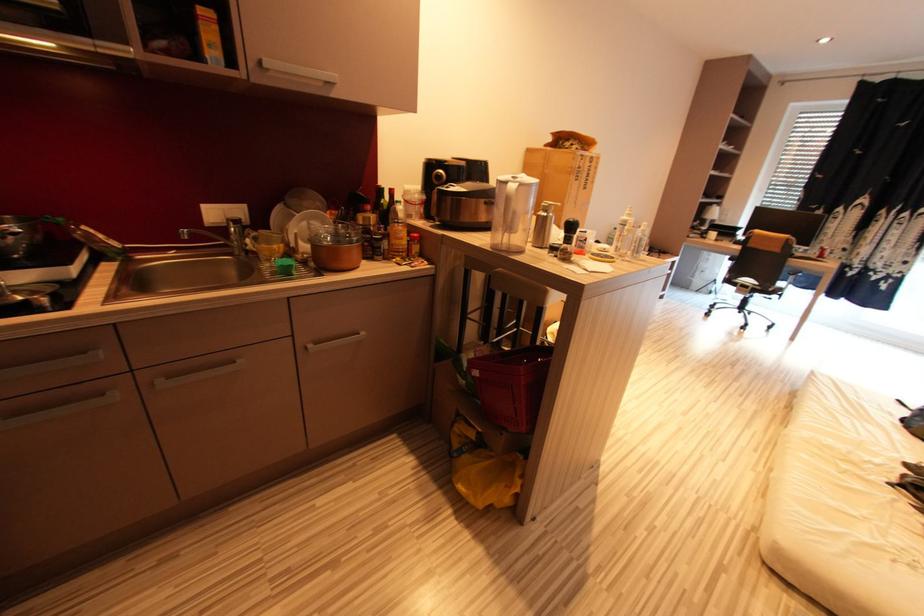
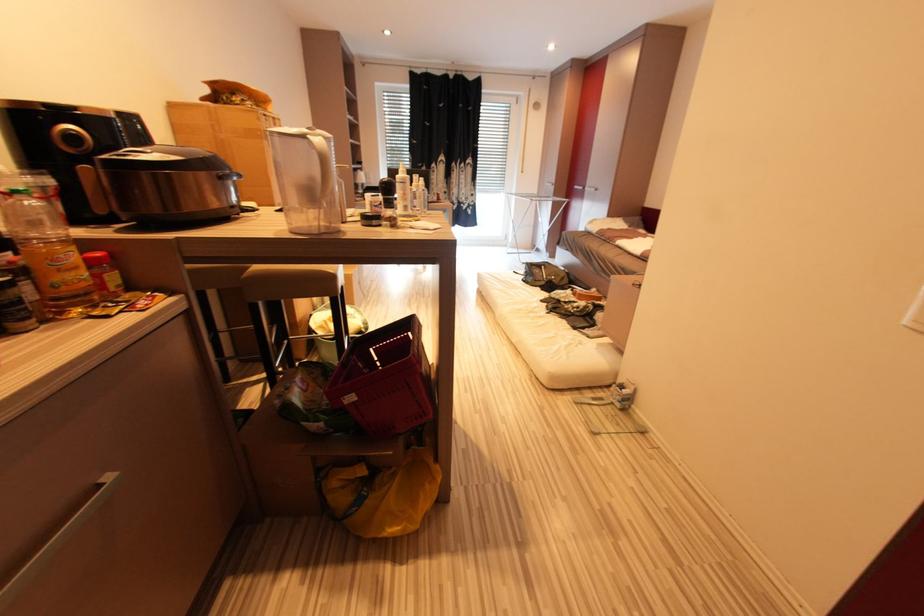
Question: The camera is either moving clockwise (left) or counter-clockwise (right) around the object. The first image is from the beginning of the video and the second image is from the end. Is the camera moving left or right when shooting the video?

Choices:
 (A) Left
 (B) Right

Answer: (A)